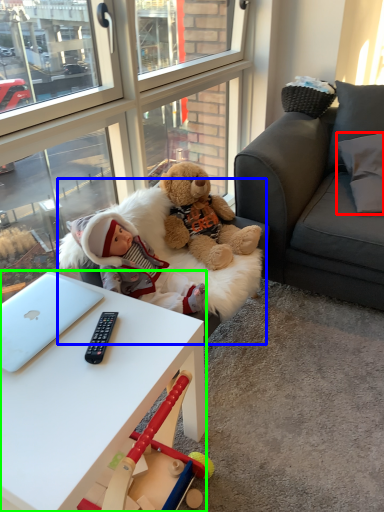
Question: Based on their relative distances, which object is farther from pillow (highlighted by a red box)? Choose from swivel chair (highlighted by a blue box) and desk (highlighted by a green box).

Choices:
 (A) swivel chair
 (B) desk

Answer: (B)